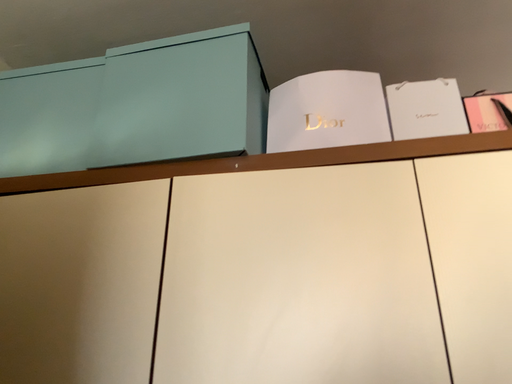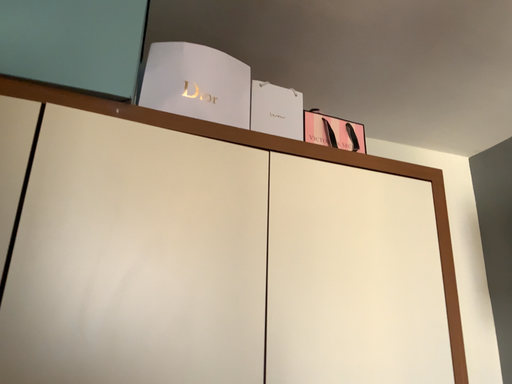
Question: Which way did the camera rotate in the video?

Choices:
 (A) rotated downward
 (B) rotated upward

Answer: (A)